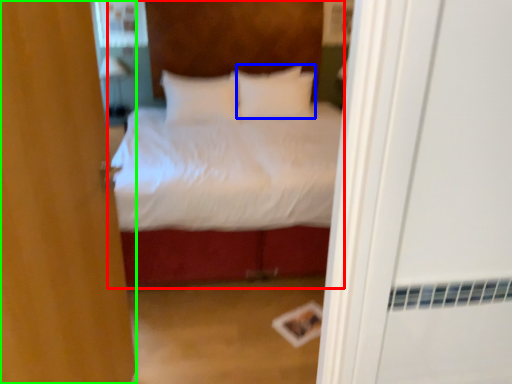
Question: Which is nearer to the bed (highlighted by a red box)? pillow (highlighted by a blue box) or door (highlighted by a green box).

Choices:
 (A) pillow
 (B) door

Answer: (A)